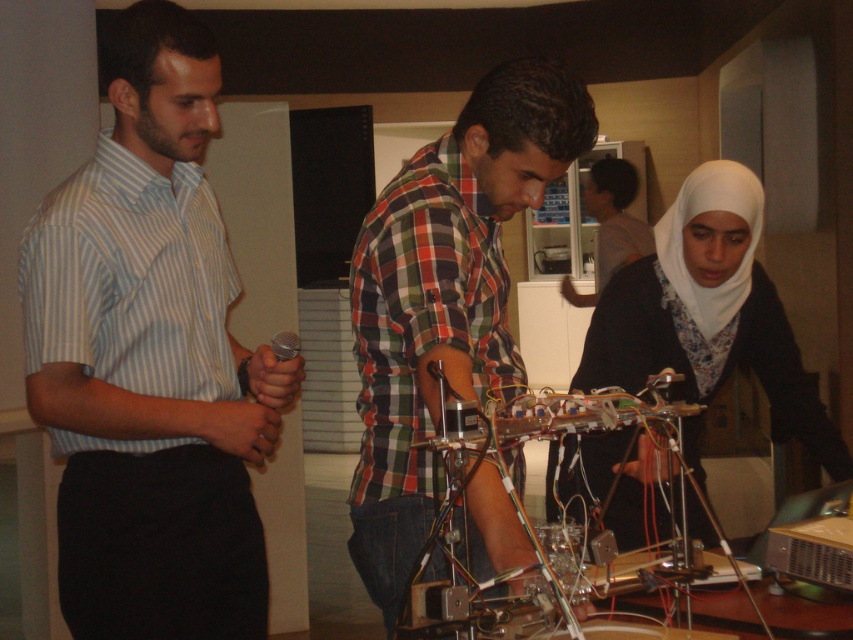
Based on the photo, you are a photographer positioned in front of the scene. You need to take a photo that clearly shows both the white matte hijab at center and the plaid shirt at center. Which object should you focus on first to ensure both are in focus?

You should focus on the white matte hijab at center first because it is closer to the viewer than the plaid shirt at center, so focusing on it will ensure the plaid shirt at center remains in focus as well.

You are a photographer positioned at the back of the room. You need to take a photo of both the light blue striped shirt at left and the checkered fabric shirt at center. Can you fit both individuals in the frame without moving your position?

The distance between the light blue striped shirt at left and the checkered fabric shirt at center is 34.34 centimeters. Since the photographer is positioned at the back, the camera should be able to capture both individuals in the frame as they are only 34.34 cm apart, which is within a typical camera lens range.

You are standing at the entrance of the room and want to greet both the white matte hijab at center and the plaid shirt at center. Which one should you approach first to minimize the walking distance?

You should approach the plaid shirt at center first because it is closer to the entrance than the white matte hijab at center, which is 3.18 meters away from the plaid shirt at center.